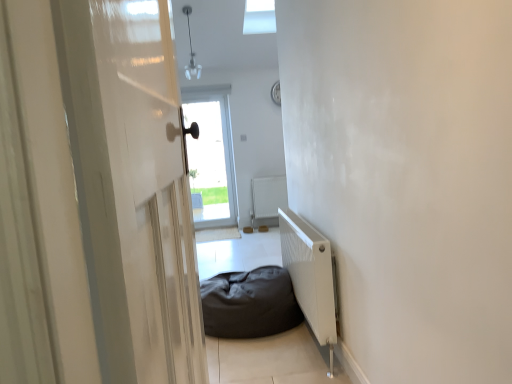
Question: Is white glossy door at left in front of or behind dark fabric bean bag at center in the image?

Choices:
 (A) behind
 (B) front

Answer: (B)

Question: From the image's perspective, relative to dark fabric bean bag at center, is white glossy door at left above or below?

Choices:
 (A) below
 (B) above

Answer: (B)

Question: Which object is positioned closest to the white glossy door at left?

Choices:
 (A) transparent glass door at center
 (B) white matte radiator at lower right, acting as the second radiator starting from the back
 (C) dark fabric bean bag at center
 (D) white matte radiator at center, the 1th radiator in the back-to-front sequence

Answer: (B)

Question: Based on their relative distances, which object is nearer to the dark fabric bean bag at center?

Choices:
 (A) transparent glass door at center
 (B) white matte radiator at center, the 1th radiator in the back-to-front sequence
 (C) white glossy door at left
 (D) white matte radiator at lower right, arranged as the 1th radiator when viewed from the front

Answer: (D)